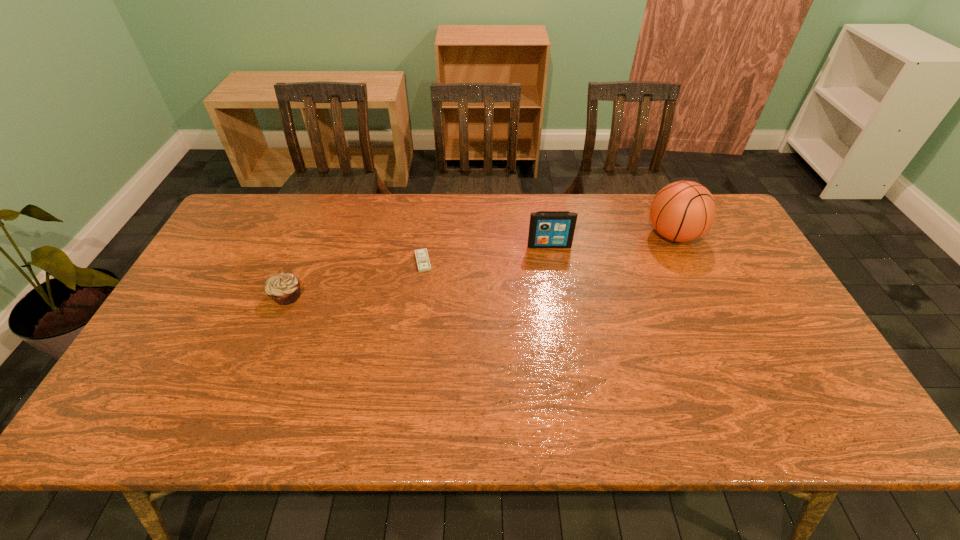
Image resolution: width=960 pixels, height=540 pixels. What are the coordinates of `vacant point located between the third object from right to left and the rightmost object` in the screenshot? It's located at (548, 248).

The width and height of the screenshot is (960, 540). Identify the location of free space between the iPod and the leftmost object. (419, 271).

You are a GUI agent. You are given a task and a screenshot of the screen. Output one action in this format:
    pyautogui.click(x=<x>, y=<y>)
    Task: Click on the empty location between the tallest object and the third tallest object
    This screenshot has height=540, width=960.
    Given the screenshot: What is the action you would take?
    pyautogui.click(x=480, y=265)

At what (x,y) coordinates should I click in order to perform the action: click on free area in between the shortest object and the muffin. Please return your answer as a coordinate pair (x, y). The image size is (960, 540). Looking at the image, I should click on (355, 279).

The image size is (960, 540). Identify the location of vacant area between the third shortest object and the basketball. (612, 240).

In order to click on free space that is in between the iPod and the tallest object in this screenshot , I will do 612,240.

Identify the location of vacant space in between the third object from right to left and the rightmost object. This screenshot has width=960, height=540. (548, 248).

Find the location of a particular element. The height and width of the screenshot is (540, 960). unoccupied area between the basketball and the leftmost object is located at coordinates (480, 265).

Locate an element on the screen. vacant region between the second object from left to right and the muffin is located at coordinates (355, 279).

Where is `unoccupied position between the basketball and the iPod`? unoccupied position between the basketball and the iPod is located at coordinates (612, 240).